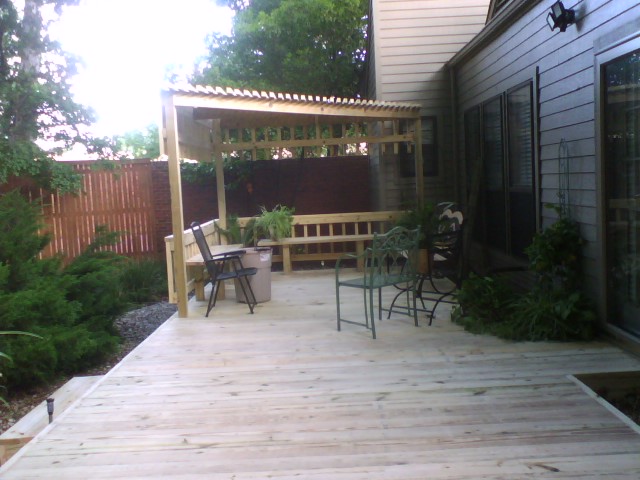
Where is `sliding glass door`? The height and width of the screenshot is (480, 640). sliding glass door is located at coordinates (628, 186).